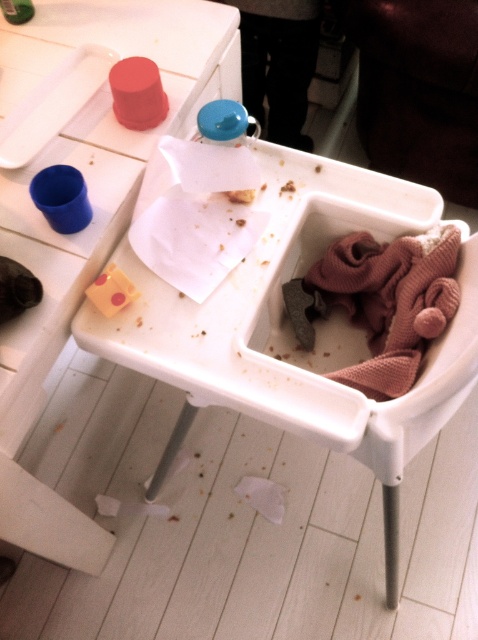
Is soft pink fabric at lower right thinner than yellow cheese slice at upper center?

Incorrect, soft pink fabric at lower right's width is not less than yellow cheese slice at upper center's.

Between soft pink fabric at lower right and yellow cheese slice at upper center, which one is positioned lower?

Positioned lower is soft pink fabric at lower right.

Between point (399, 237) and point (235, 195), which one is positioned behind?

The point (235, 195) is more distant.

Image resolution: width=478 pixels, height=640 pixels. I want to click on soft pink fabric at lower right, so click(390, 301).

Consider the image. Does white plastic tray at center appear on the right side of soft pink fabric at lower right?

Incorrect, white plastic tray at center is not on the right side of soft pink fabric at lower right.

Who is more forward, (452, 404) or (338, 296)?

Point (452, 404) is more forward.

The image size is (478, 640). What do you see at coordinates (283, 326) in the screenshot?
I see `white plastic tray at center` at bounding box center [283, 326].

Where is `white plastic tray at center`? This screenshot has height=640, width=478. white plastic tray at center is located at coordinates (283, 326).

Can you confirm if white plastic tray at center is positioned to the right of white plastic tray at upper left?

Indeed, white plastic tray at center is positioned on the right side of white plastic tray at upper left.

The width and height of the screenshot is (478, 640). Describe the element at coordinates (283, 326) in the screenshot. I see `white plastic tray at center` at that location.

Does point (389, 589) lie in front of point (152, 38)?

No, it is behind (152, 38).

The image size is (478, 640). In order to click on white plastic tray at center in this screenshot , I will do `click(283, 326)`.